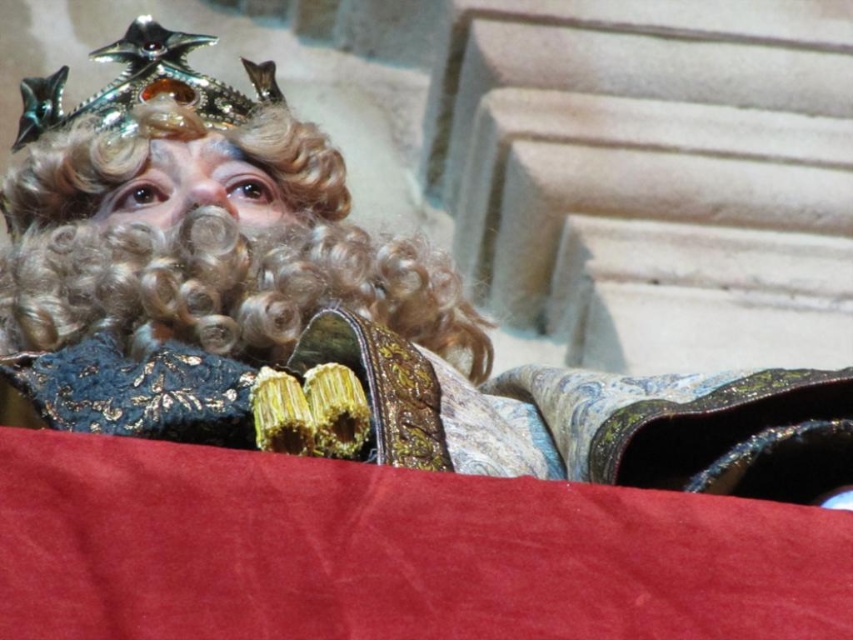
You are a costume designer preparing for a play. You need to ensure that the shiny metallic crown at upper left doesn not obstruct the view of the curly blonde wig at upper center during the performance. Based on their positions, which object is more to the left?

The shiny metallic crown at upper left is more to the left than the curly blonde wig at upper center.